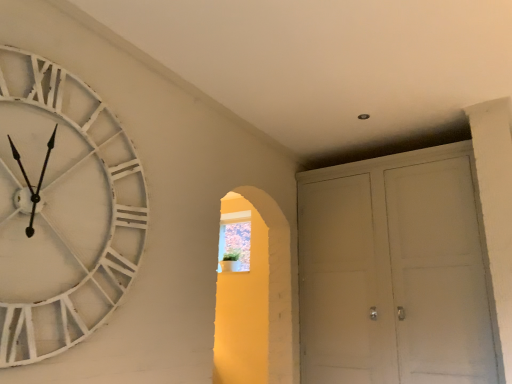
Question: Would you say translucent glass window at center is inside or outside white matte cabinet at right?

Choices:
 (A) inside
 (B) outside

Answer: (B)

Question: From the image's perspective, is translucent glass window at center positioned above or below white matte cabinet at right?

Choices:
 (A) below
 (B) above

Answer: (A)

Question: Which object is the farthest from the white distressed wood clock at left?

Choices:
 (A) translucent glass window at center
 (B) white matte cabinet at right

Answer: (A)

Question: Which is nearer to the white matte cabinet at right?

Choices:
 (A) translucent glass window at center
 (B) white distressed wood clock at left

Answer: (A)